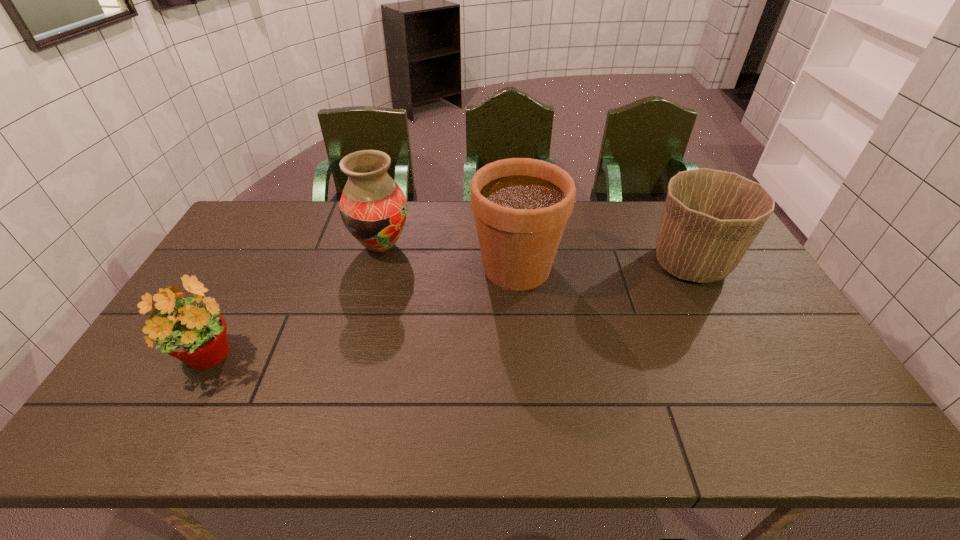
You are a GUI agent. You are given a task and a screenshot of the screen. Output one action in this format:
    pyautogui.click(x=<x>, y=<y>)
    Task: Click on the third object from right to left
    The image size is (960, 540).
    Given the screenshot: What is the action you would take?
    pyautogui.click(x=373, y=208)

Locate an element on the screen. This screenshot has height=540, width=960. the second object from right to left is located at coordinates (521, 206).

This screenshot has height=540, width=960. I want to click on the rightmost object, so click(710, 218).

At what (x,y) coordinates should I click in order to perform the action: click on the nearest flowerpot. Please return your answer as a coordinate pair (x, y). Looking at the image, I should click on (195, 334).

Find the location of `the nearest object`. the nearest object is located at coordinates (195, 334).

This screenshot has height=540, width=960. What are the coordinates of `free space located on the back of the second object from left to right` in the screenshot? It's located at (391, 212).

Find the location of a particular element. This screenshot has height=540, width=960. free space located on the right of the third object from left to right is located at coordinates (615, 268).

Identify the location of free space located 0.210m on the left of the rightmost object. (581, 264).

What are the coordinates of `free location located 0.330m on the right of the nearest flowerpot` in the screenshot? It's located at (378, 359).

Where is `vase located at the far edge`? Image resolution: width=960 pixels, height=540 pixels. vase located at the far edge is located at coordinates (373, 208).